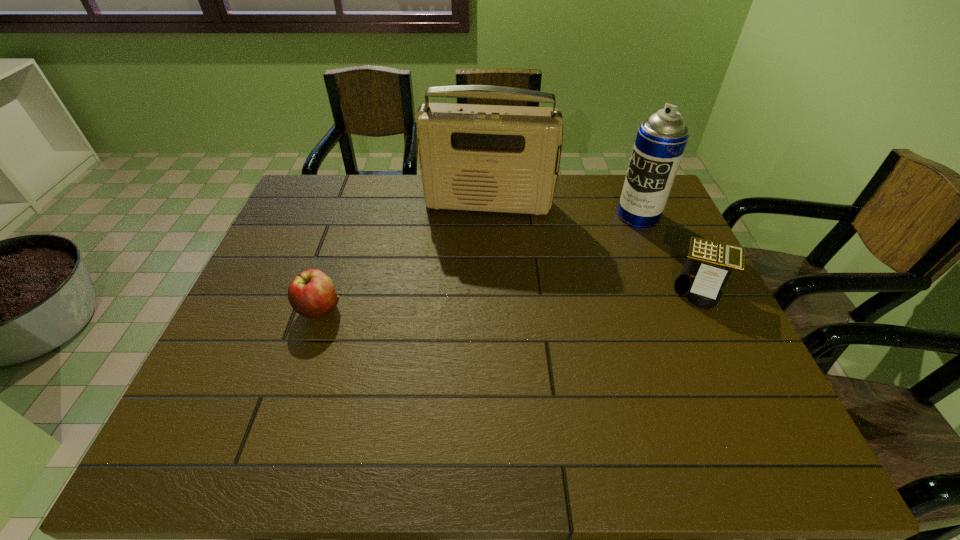
Where is `vacant region at the right edge of the desktop`? This screenshot has width=960, height=540. vacant region at the right edge of the desktop is located at coordinates (654, 241).

Where is `free region at the far left corner of the desktop`? The height and width of the screenshot is (540, 960). free region at the far left corner of the desktop is located at coordinates (306, 176).

Locate an element on the screen. The height and width of the screenshot is (540, 960). blank space at the near left corner of the desktop is located at coordinates (224, 405).

Locate an element on the screen. free space at the far right corner of the desktop is located at coordinates (615, 183).

I want to click on free area in between the apple and the radio receiver, so click(404, 256).

The image size is (960, 540). I want to click on free spot between the radio receiver and the apple, so click(404, 256).

Image resolution: width=960 pixels, height=540 pixels. In order to click on free space between the calculator and the radio receiver in this screenshot , I will do `click(595, 246)`.

Find the location of a particular element. This screenshot has width=960, height=540. vacant space that's between the leftmost object and the aerosol can is located at coordinates (479, 262).

Where is `empty location between the calculator and the second object from left to right`? The height and width of the screenshot is (540, 960). empty location between the calculator and the second object from left to right is located at coordinates (595, 246).

Find the location of a particular element. unoccupied area between the aerosol can and the radio receiver is located at coordinates (564, 210).